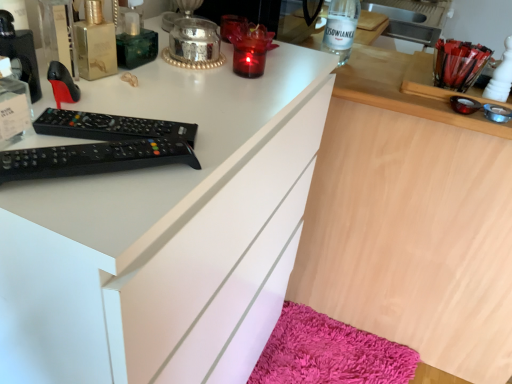
This screenshot has width=512, height=384. Find the location of `vacant region in front of black plastic remote control at upper left`. vacant region in front of black plastic remote control at upper left is located at coordinates (81, 202).